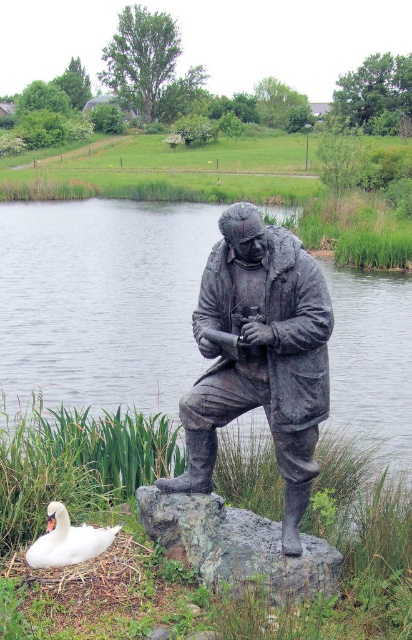
Question: Considering the relative positions of glossy water at statue right and white matte swan at lower left in the image provided, where is glossy water at statue right located with respect to white matte swan at lower left?

Choices:
 (A) above
 (B) below

Answer: (A)

Question: In this image, where is bronze statue at center located relative to white matte swan at lower left?

Choices:
 (A) left
 (B) right

Answer: (B)

Question: Which of the following is the closest to the observer?

Choices:
 (A) (260, 314)
 (B) (203, 538)

Answer: (A)

Question: Can you confirm if glossy water at statue right is smaller than rough gray rock at center?

Choices:
 (A) yes
 (B) no

Answer: (B)

Question: Which object appears farthest from the camera in this image?

Choices:
 (A) glossy water at statue right
 (B) white matte swan at lower left
 (C) bronze statue at center
 (D) rough gray rock at center

Answer: (B)

Question: Which point is farther to the camera?

Choices:
 (A) bronze statue at center
 (B) white matte swan at lower left
 (C) rough gray rock at center

Answer: (B)